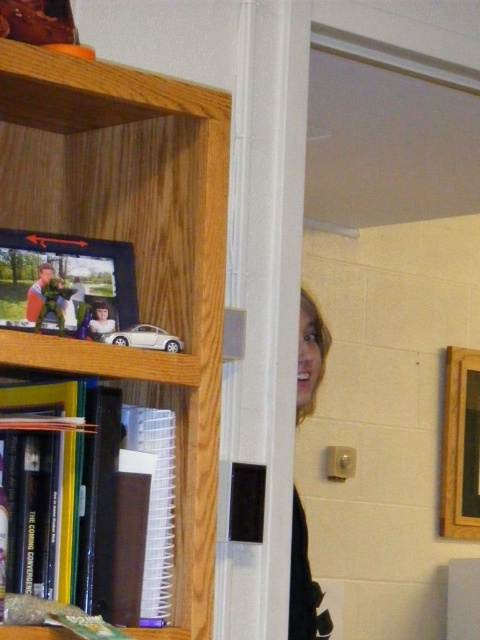
You are a GUI agent. You are given a task and a screenshot of the screen. Output one action in this format:
    pyautogui.click(x=<x>, y=<y>)
    Task: Click on the wooden bookshelf at upper left
    The image size is (480, 640).
    Given the screenshot: What is the action you would take?
    pyautogui.click(x=133, y=248)

Measure the distance between point (158, 369) and camera.

The distance of point (158, 369) from camera is 3.82 feet.

What are the coordinates of `wooden bookshelf at upper left` in the screenshot? It's located at (133, 248).

Who is positioned more to the right, wooden bookshelf at upper left or matte plastic picture frame at left?

wooden bookshelf at upper left is more to the right.

Can you confirm if wooden bookshelf at upper left is positioned to the left of matte plastic picture frame at left?

No, wooden bookshelf at upper left is not to the left of matte plastic picture frame at left.

Which is in front, point (24, 189) or point (39, 310)?

Point (39, 310) is in front.

Identify the location of wooden bookshelf at upper left. Image resolution: width=480 pixels, height=640 pixels. (133, 248).

How distant is matte plastic picture frame at left from smooth black hair at door right?

37.56 inches

The width and height of the screenshot is (480, 640). Describe the element at coordinates (66, 284) in the screenshot. I see `matte plastic picture frame at left` at that location.

Is point (74, 253) positioned in front of point (307, 600)?

That is True.

I want to click on matte plastic picture frame at left, so click(x=66, y=284).